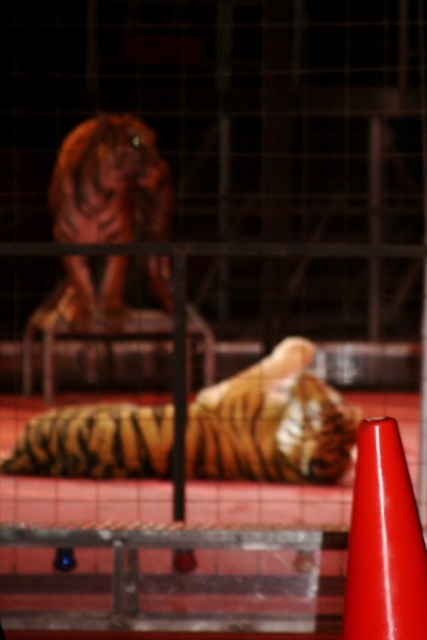
You are a zookeeper trying to locate a specific point in the tiger enclosure. The point you need to find is at coordinates point (110, 182). Which part of the tiger is this point located on?

The point (110, 182) is on the orange brown fur tiger at upper left.